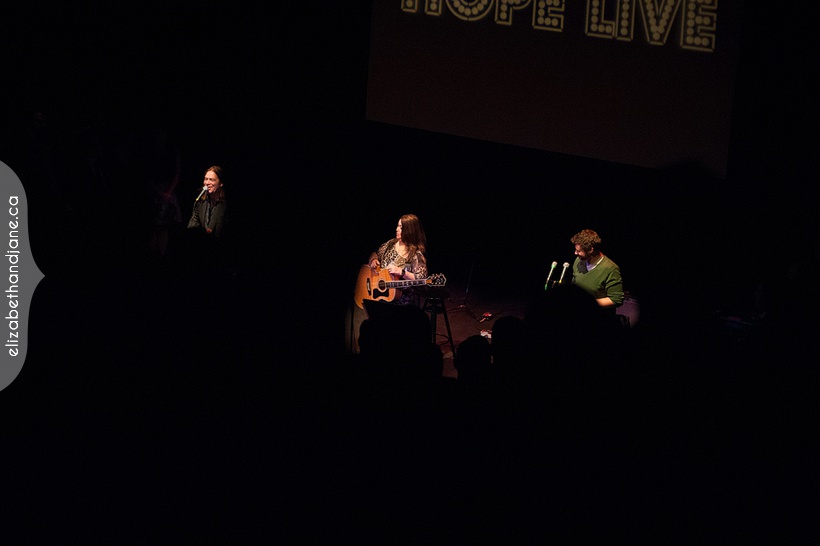
What are the coordinates of `stage` in the screenshot? It's located at (457, 331).